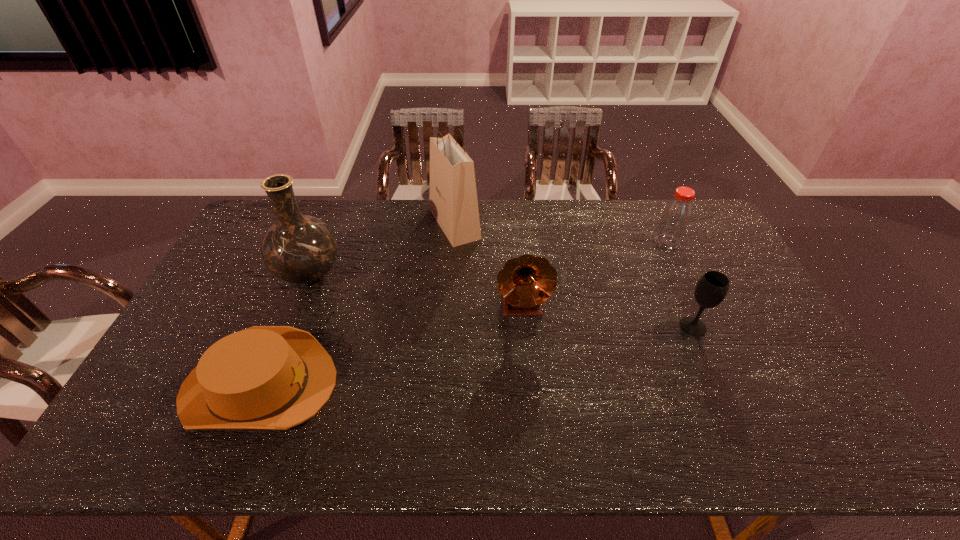
The height and width of the screenshot is (540, 960). I want to click on shopping bag, so click(453, 202).

Where is `vase`? vase is located at coordinates (300, 249).

Where is `phonograph_record`? The width and height of the screenshot is (960, 540). phonograph_record is located at coordinates (526, 282).

I want to click on bottle, so click(675, 219).

Where is `wineglass`? This screenshot has width=960, height=540. wineglass is located at coordinates (711, 289).

At what (x,y) coordinates should I click in order to perform the action: click on cowboy hat. Please return your answer as a coordinate pair (x, y). Looking at the image, I should click on (264, 377).

Where is `the nearest object`? Image resolution: width=960 pixels, height=540 pixels. the nearest object is located at coordinates (264, 377).

The width and height of the screenshot is (960, 540). I want to click on vacant point located on the left of the shopping bag, so coord(408,224).

The image size is (960, 540). In order to click on free space located on the back of the vase in this screenshot , I will do `click(324, 237)`.

In order to click on free space located 0.260m on the horn of the fourth object from left to right in this screenshot , I will do `click(532, 409)`.